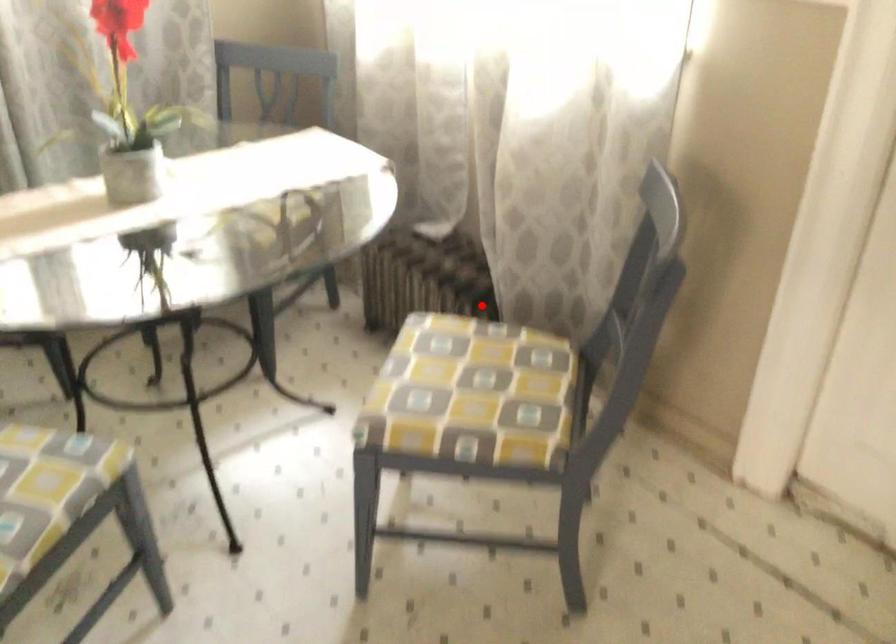
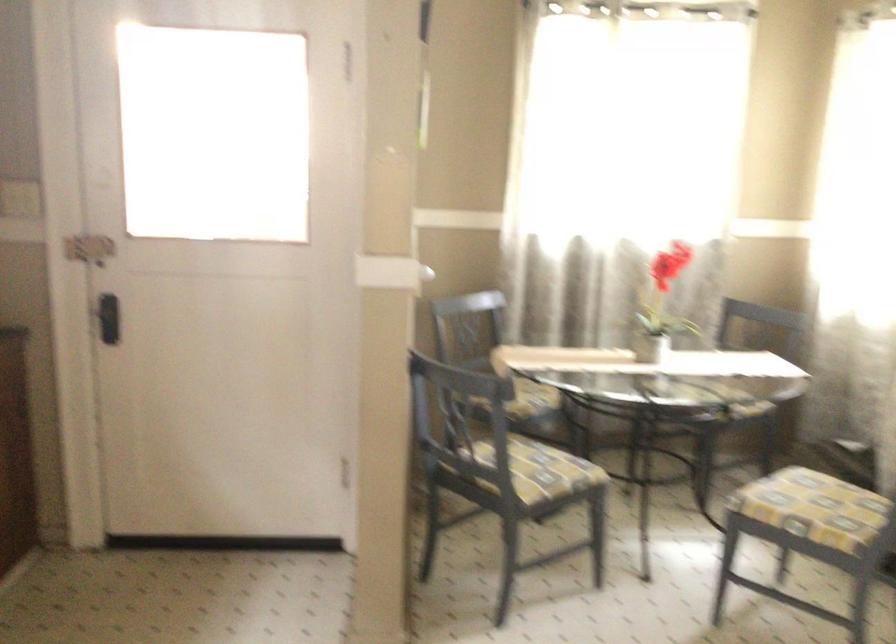
Question: I am providing you with two images of the same scene from different viewpoints. Given a red point in image1, look at the same physical point in image2. Is it:

Choices:
 (A) Closer to the viewpoint
 (B) Farther from the viewpoint

Answer: (B)